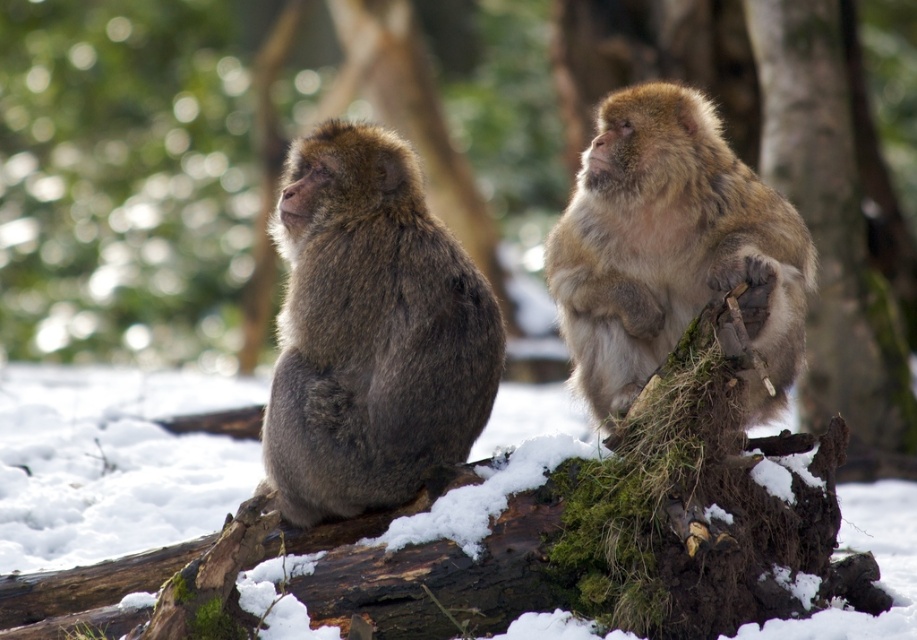
You are a wildlife photographer aiming to capture a closeup shot of the brown furry monkey at left. Given that your camera has a minimum focusing distance of 5 meters, will you be able to take the photo without moving closer?

The brown furry monkey at left is 6.02 meters away from viewer, which is beyond the camera minimum focusing distance of 5 meters. Therefore, you can take the photo without moving closer.

You are a wildlife photographer aiming to capture both monkeys in a single shot. Given that your camera has a fixed focus point at point (x=370, y=332), which corresponds to the brown furry monkey at left, where should you position your camera to ensure the lighter monkey on the right is also in focus?

Position your camera so that the focus point at point (x=370, y=332), which marks the brown furry monkey at left, is centered. Since the lighter monkey on the right is positioned away from this point, adjusting the focus to include both subjects might require a wider aperture or a smaller aperture depending on the depth of field. However, since the question specifies the focus point is fixed at the brown monkey, you should ensure both monkeys are within the depth of field by using a smaller aperture to extend